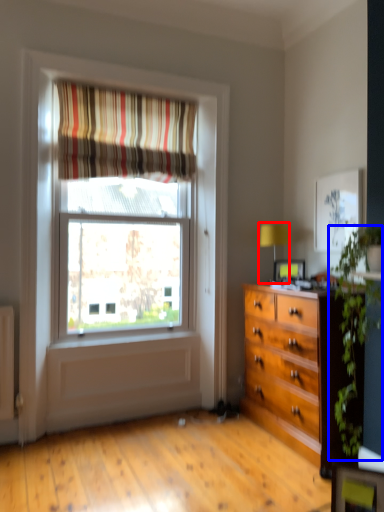
Question: Which point is further to the camera, table lamp (highlighted by a red box) or plant (highlighted by a blue box)?

Choices:
 (A) table lamp
 (B) plant

Answer: (A)